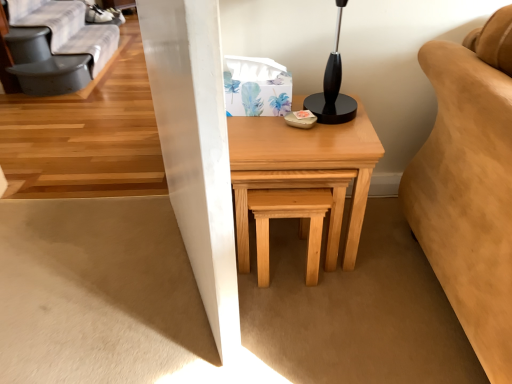
The width and height of the screenshot is (512, 384). Find the location of `free space above natural wood stool at center (from a real-world perspective)`. free space above natural wood stool at center (from a real-world perspective) is located at coordinates (290, 186).